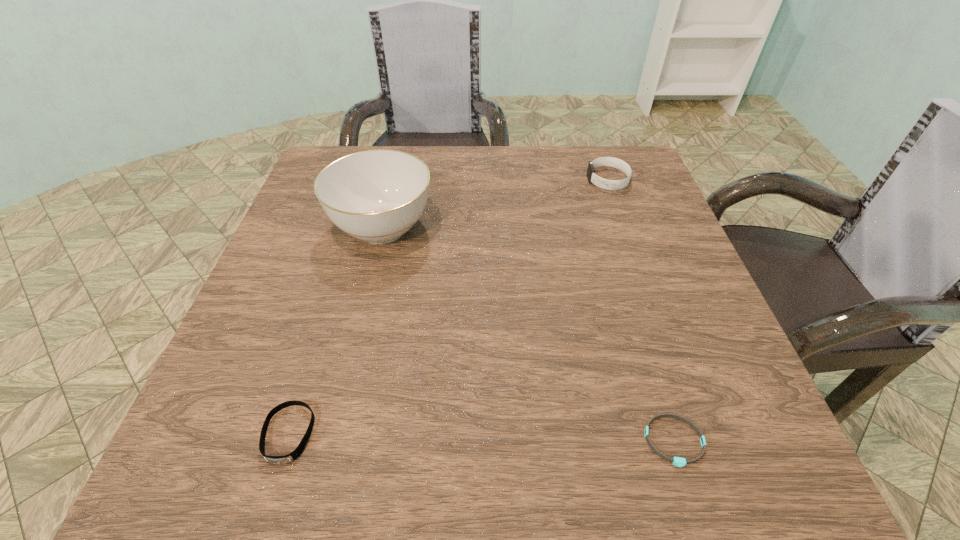
At what (x,y) coordinates should I click in order to perform the action: click on chinaware. Please return your answer as a coordinate pair (x, y). Image resolution: width=960 pixels, height=540 pixels. Looking at the image, I should click on (377, 196).

This screenshot has height=540, width=960. Find the location of `the third nearest object`. the third nearest object is located at coordinates (377, 196).

You are a GUI agent. You are given a task and a screenshot of the screen. Output one action in this format:
    pyautogui.click(x=<x>, y=<y>)
    Task: Click on the tallest wristband
    The image size is (960, 540).
    Given the screenshot: What is the action you would take?
    click(x=603, y=183)

Where is `the farthest wristband`? This screenshot has width=960, height=540. the farthest wristband is located at coordinates (603, 183).

Identify the location of the third tallest object. The image size is (960, 540). (278, 460).

Locate an element on the screen. The width and height of the screenshot is (960, 540). the second tallest wristband is located at coordinates (278, 460).

Find the location of `the shortest wristband`. the shortest wristband is located at coordinates (677, 461).

At what (x,y) coordinates should I click in order to perform the action: click on free location located 0.330m on the front of the tallest object. Please return your answer as a coordinate pair (x, y). This screenshot has height=540, width=960. Looking at the image, I should click on (338, 417).

At what (x,y) coordinates should I click in order to perform the action: click on blank space located 0.290m on the outer surface of the farthest object. Please return your answer as a coordinate pair (x, y). Looking at the image, I should click on (472, 180).

At what (x,y) coordinates should I click in order to perform the action: click on vacant space located 0.170m on the outer surface of the farthest object. Please return your answer as a coordinate pair (x, y). Looking at the image, I should click on (519, 180).